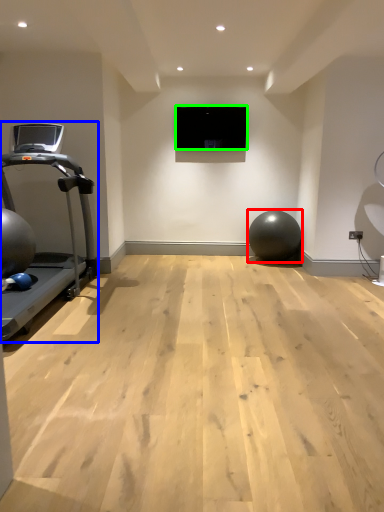
Question: Which is nearer to the ball (highlighted by a red box)? treadmill (highlighted by a blue box) or projection screen (highlighted by a green box).

Choices:
 (A) treadmill
 (B) projection screen

Answer: (B)